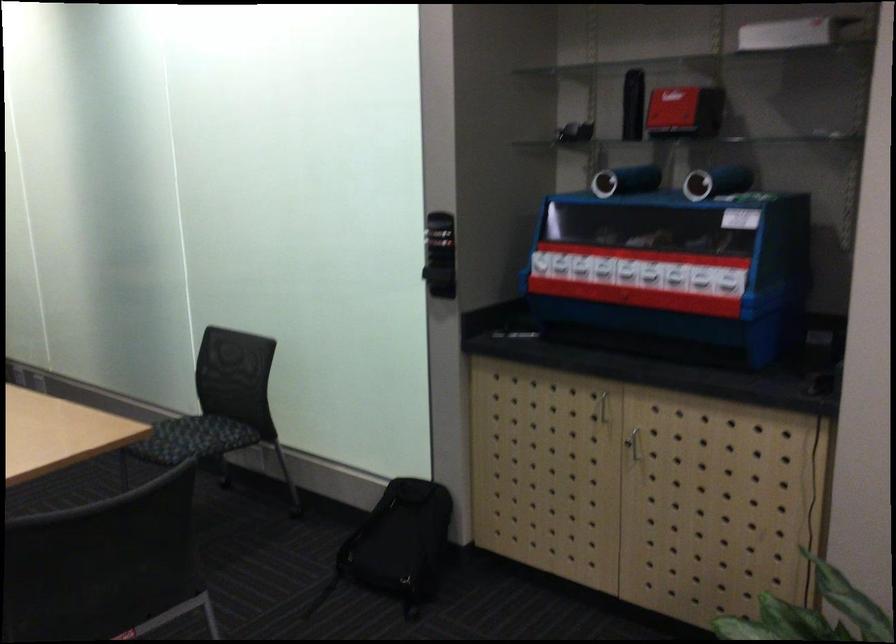
Describe the element at coordinates (672, 108) in the screenshot. This screenshot has height=644, width=896. I see `the red box` at that location.